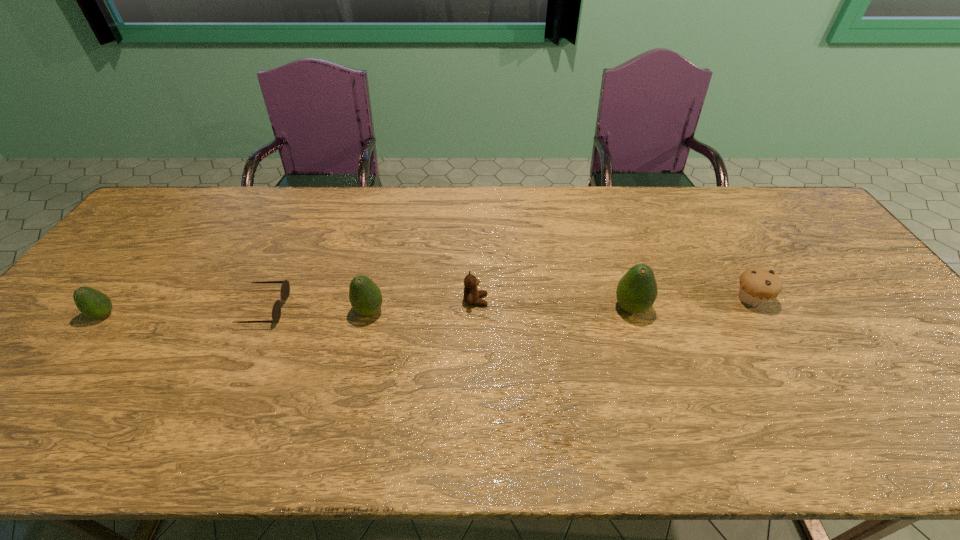
The image size is (960, 540). I want to click on free space located 0.170m on the back of the leftmost avocado, so click(146, 262).

Locate an element on the screen. vacant space located 0.240m on the right of the second tallest object is located at coordinates (476, 312).

Identify the location of free region located on the left of the second object from right to left. This screenshot has width=960, height=540. (x=522, y=308).

At what (x,y) coordinates should I click in order to perform the action: click on free location located at the face of the third object from right to left. Please return your answer as a coordinate pair (x, y). Looking at the image, I should click on (636, 300).

Locate an element on the screen. blank space located 0.250m on the front-facing side of the sunglasses is located at coordinates (379, 308).

Identify the location of blank space located 0.240m on the left of the rightmost object. The image size is (960, 540). (643, 299).

I want to click on object at the left edge, so point(92,303).

What are the coordinates of `free space at the far edge of the desktop` in the screenshot? It's located at (682, 206).

Image resolution: width=960 pixels, height=540 pixels. In order to click on vacant space at the near edge in this screenshot , I will do `click(493, 374)`.

Where is `vacant space at the left edge of the desktop`? This screenshot has width=960, height=540. vacant space at the left edge of the desktop is located at coordinates (156, 265).